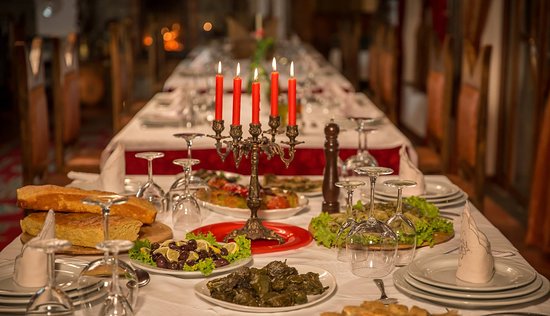
The height and width of the screenshot is (316, 550). I want to click on paper towel, so click(x=475, y=257).